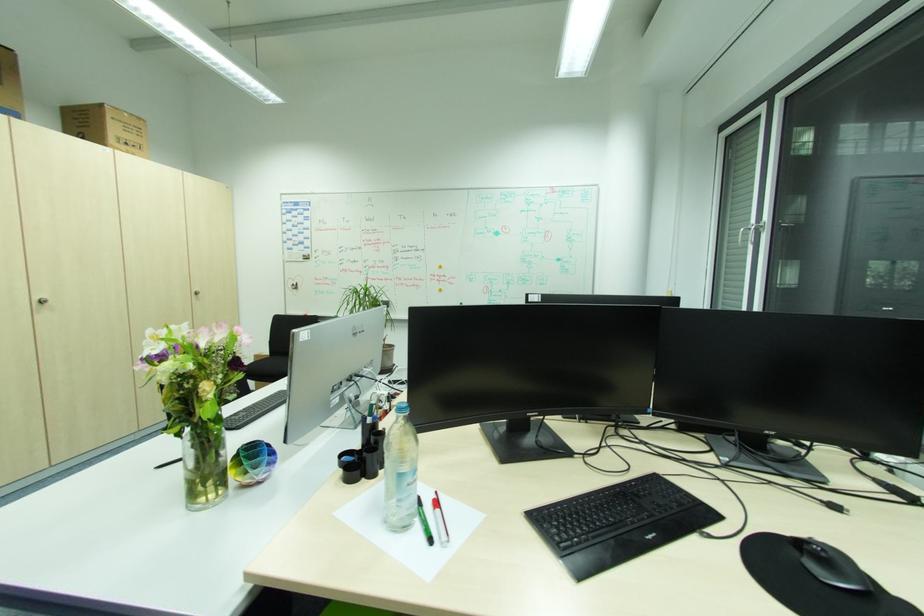
Identify the location of black keyboard. The width and height of the screenshot is (924, 616). (618, 523).